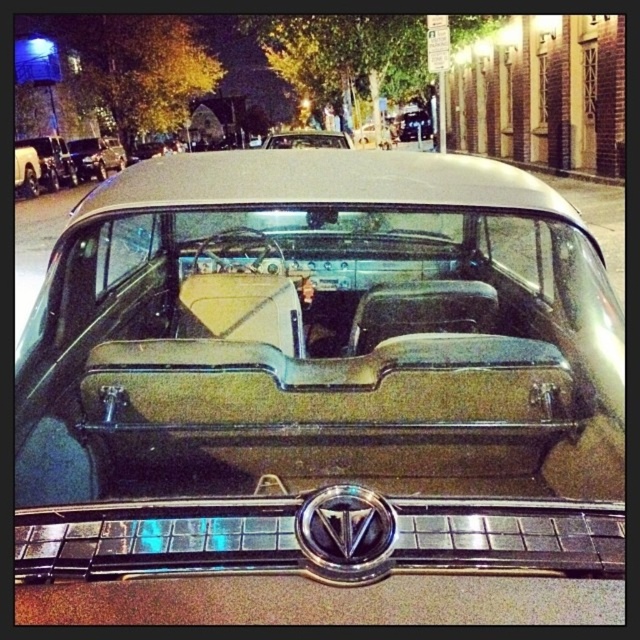
Between metallic tan car at center and shiny beige leather car at center, which one appears on the right side from the viewer's perspective?

metallic tan car at center is more to the right.

Identify the location of metallic tan car at center. (321, 397).